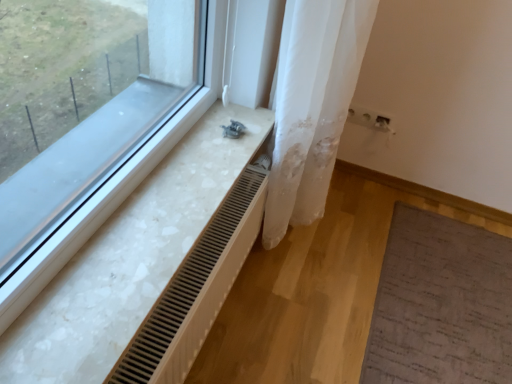
This screenshot has height=384, width=512. In order to click on white marble radiator at lower left in this screenshot , I will do `click(91, 121)`.

Locate an element on the screen. white sheer fabric at center is located at coordinates (312, 105).

This screenshot has height=384, width=512. Find the location of `wooden radiator at lower left`. wooden radiator at lower left is located at coordinates (195, 289).

Is white sheer fabric at center smaller than wooden radiator at lower left?

No.

From a real-world perspective, is white sheer fabric at center positioned above or below wooden radiator at lower left?

Clearly, from a real-world perspective, white sheer fabric at center is above wooden radiator at lower left.

Considering the relative positions of white sheer fabric at center and wooden radiator at lower left in the image provided, is white sheer fabric at center to the right of wooden radiator at lower left from the viewer's perspective?

Yes.

Is wooden radiator at lower left facing away from white marble radiator at lower left?

wooden radiator at lower left does not have its back to white marble radiator at lower left.

Find the location of a particular element. window in front of the wooden radiator at lower left is located at coordinates (91, 121).

Is wooden radiator at lower left next to white sheer fabric at center?

No, wooden radiator at lower left is not with white sheer fabric at center.

Is wooden radiator at lower left inside the boundaries of white sheer fabric at center, or outside?

wooden radiator at lower left is not enclosed by white sheer fabric at center.

Looking at their sizes, would you say wooden radiator at lower left is wider or thinner than white sheer fabric at center?

Considering their sizes, wooden radiator at lower left looks slimmer than white sheer fabric at center.

Considering the positions of points (195, 243) and (324, 137), is point (195, 243) farther from camera compared to point (324, 137)?

That is False.

From the picture: Considering the sizes of white marble radiator at lower left and wooden radiator at lower left in the image, is white marble radiator at lower left wider or thinner than wooden radiator at lower left?

Considering their sizes, white marble radiator at lower left looks broader than wooden radiator at lower left.

From the image's perspective, which is below, white marble radiator at lower left or wooden radiator at lower left?

wooden radiator at lower left appears lower in the image.

Is point (170, 147) farther from viewer compared to point (138, 351)?

Yes, point (170, 147) is behind point (138, 351).

What's the angular difference between white marble radiator at lower left and wooden radiator at lower left's facing directions?

0.458 degrees.

Considering the sizes of objects white sheer fabric at center and white marble radiator at lower left in the image provided, who is smaller, white sheer fabric at center or white marble radiator at lower left?

With smaller size is white marble radiator at lower left.

Could you tell me if white sheer fabric at center is turned towards white marble radiator at lower left?

No, white sheer fabric at center is not aimed at white marble radiator at lower left.

What's the angular difference between white sheer fabric at center and white marble radiator at lower left's facing directions?

They differ by 0.582 degrees in their facing directions.

Is point (346, 50) closer to camera compared to point (98, 21)?

Yes.

Where is `window located below the white sheer fabric at center (from the image's perspective)`? The width and height of the screenshot is (512, 384). window located below the white sheer fabric at center (from the image's perspective) is located at coordinates (91, 121).

Is white marble radiator at lower left far away from white sheer fabric at center?

They are positioned close to each other.

Which of these two, white marble radiator at lower left or white sheer fabric at center, is wider?

With larger width is white marble radiator at lower left.

The height and width of the screenshot is (384, 512). Find the location of `radiator below the white sheer fabric at center (from the image's perspective)`. radiator below the white sheer fabric at center (from the image's perspective) is located at coordinates (195, 289).

Locate an element on the screen. The image size is (512, 384). radiator lying behind the white marble radiator at lower left is located at coordinates (195, 289).

Based on their spatial positions, is white sheer fabric at center or white marble radiator at lower left closer to wooden radiator at lower left?

white marble radiator at lower left.

Considering their positions, is wooden radiator at lower left positioned further to white sheer fabric at center than white marble radiator at lower left?

The object further to white sheer fabric at center is white marble radiator at lower left.

Looking at this image, estimate the real-world distances between objects in this image. Which object is closer to white marble radiator at lower left, white sheer fabric at center or wooden radiator at lower left?

wooden radiator at lower left lies closer to white marble radiator at lower left than the other object.

From the image, which object appears to be nearer to wooden radiator at lower left, white marble radiator at lower left or white sheer fabric at center?

The object closer to wooden radiator at lower left is white marble radiator at lower left.

When comparing their distances from white marble radiator at lower left, does wooden radiator at lower left or white sheer fabric at center seem further?

white sheer fabric at center lies further to white marble radiator at lower left than the other object.

From the image, which object appears to be farther from white sheer fabric at center, white marble radiator at lower left or wooden radiator at lower left?

white marble radiator at lower left.

At what (x,y) coordinates should I click in order to perform the action: click on window between white sheer fabric at center and wooden radiator at lower left in the up-down direction. Please return your answer as a coordinate pair (x, y). Looking at the image, I should click on [x=91, y=121].